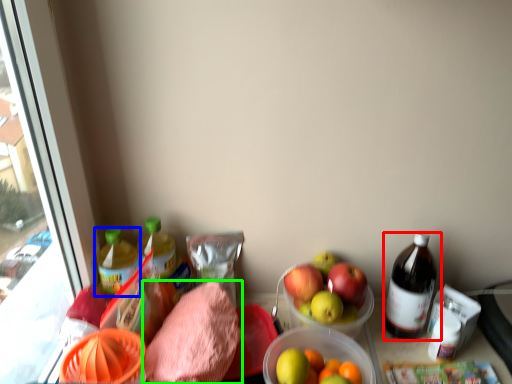
Question: Which is farther away from bottle (highlighted by a red box)? bottle (highlighted by a blue box) or waste (highlighted by a green box)?

Choices:
 (A) bottle
 (B) waste

Answer: (A)